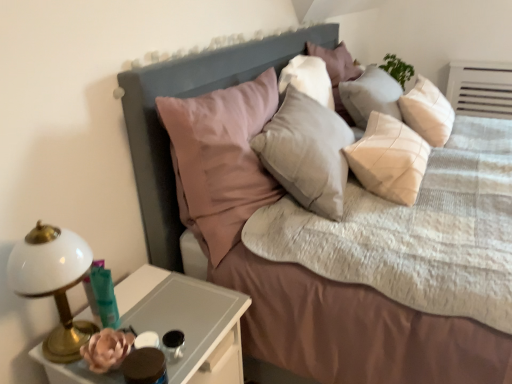
Question: Considering the positions of point (180, 226) and point (115, 319), is point (180, 226) closer or farther from the camera than point (115, 319)?

Choices:
 (A) farther
 (B) closer

Answer: (A)

Question: Considering the positions of textured beige bed at center and translucent glass candle holder at lower left, the 2th candle holder when ordered from right to left, in the image, is textured beige bed at center taller or shorter than translucent glass candle holder at lower left, the 2th candle holder when ordered from right to left,?

Choices:
 (A) short
 (B) tall

Answer: (B)

Question: Estimate the real-world distances between objects in this image. Which object is farther from the textured beige bed at center?

Choices:
 (A) translucent glass candle holder at lower left, positioned as the 1th candle holder in left-to-right order
 (B) white glossy nightstand at lower left
 (C) black glass candle holder at lower left, arranged as the second candle holder when viewed from the left
 (D) matte gray headboard at upper center
 (E) white glossy bedside lamp at left

Answer: (C)

Question: Which is farther from the white glossy bedside lamp at left?

Choices:
 (A) black glass candle holder at lower left, arranged as the 1th candle holder when viewed from the right
 (B) translucent glass candle holder at lower left, the 2th candle holder when ordered from right to left
 (C) white glossy nightstand at lower left
 (D) matte gray headboard at upper center
 (E) textured beige bed at center

Answer: (D)